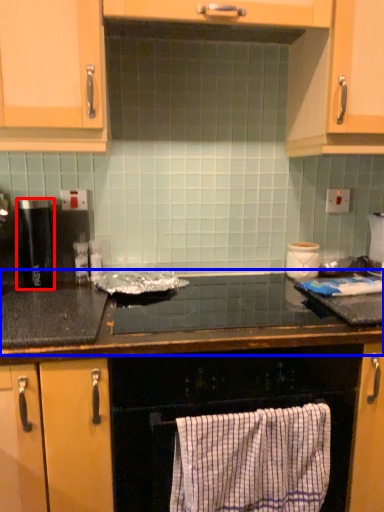
Question: Which object appears closest to the camera in this image, kitchen appliance (highlighted by a red box) or countertop (highlighted by a blue box)?

Choices:
 (A) kitchen appliance
 (B) countertop

Answer: (B)